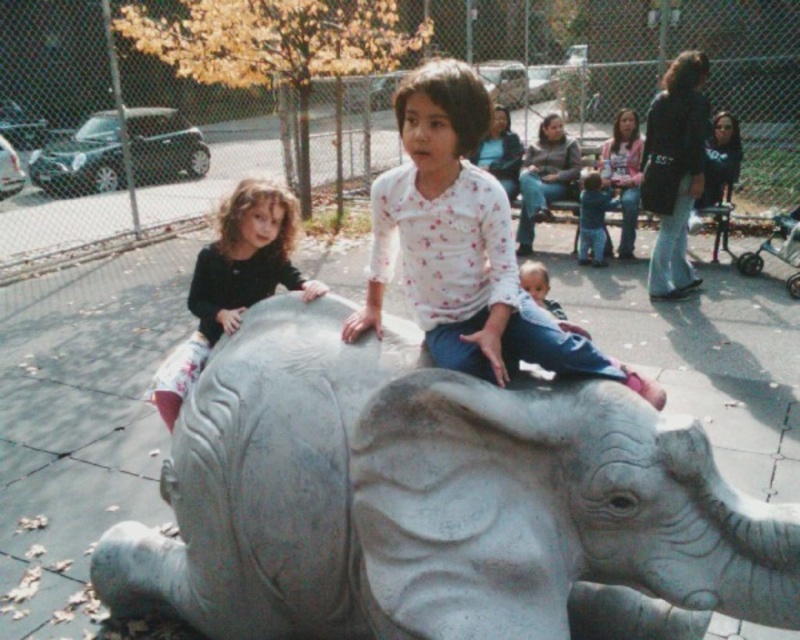
Question: Which object is positioned farthest from the white floral shirt at center?

Choices:
 (A) dark brown hair at left
 (B) gray stone elephant at center

Answer: (A)

Question: Can you confirm if white floral shirt at center is positioned to the right of dark brown hair at left?

Choices:
 (A) yes
 (B) no

Answer: (A)

Question: Which is nearer to the gray stone elephant at center?

Choices:
 (A) dark brown hair at left
 (B) white floral shirt at center

Answer: (B)

Question: Does gray stone elephant at center have a lesser width compared to white floral shirt at center?

Choices:
 (A) no
 (B) yes

Answer: (A)

Question: Does white floral shirt at center come behind dark brown hair at left?

Choices:
 (A) no
 (B) yes

Answer: (A)

Question: Estimate the real-world distances between objects in this image. Which object is closer to the dark brown hair at left?

Choices:
 (A) gray stone elephant at center
 (B) white floral shirt at center

Answer: (A)